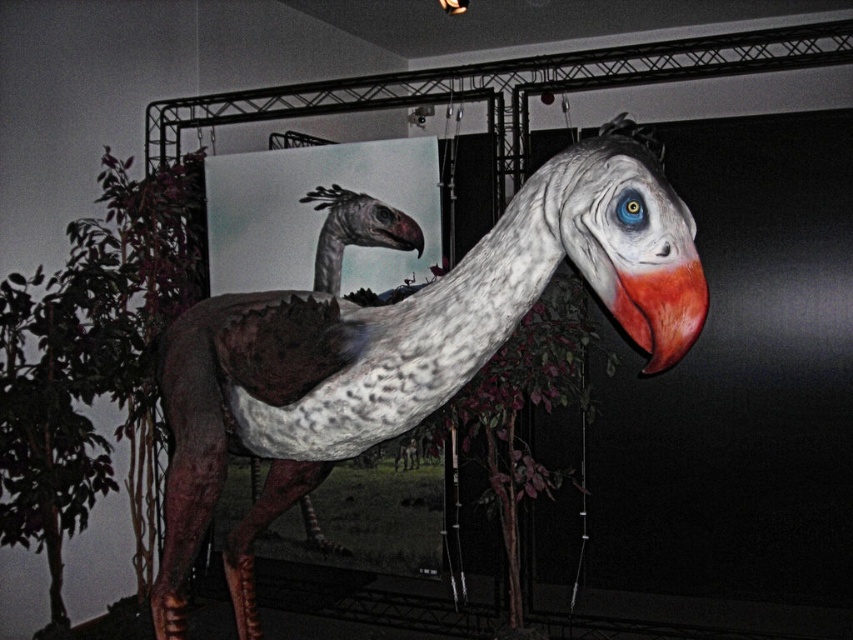
Question: Which point is closer to the camera?

Choices:
 (A) (616, 310)
 (B) (194, 355)

Answer: (A)

Question: Is speckled feathered ostrich at center below matte gray beak at center?

Choices:
 (A) yes
 (B) no

Answer: (A)

Question: Is shiny red beak at center smaller than matte gray beak at center?

Choices:
 (A) yes
 (B) no

Answer: (B)

Question: Which of the following is the farthest from the observer?

Choices:
 (A) (247, 314)
 (B) (410, 220)

Answer: (B)

Question: Estimate the real-world distances between objects in this image. Which object is closer to the speckled feathered ostrich at center?

Choices:
 (A) shiny red beak at center
 (B) matte gray beak at center

Answer: (A)

Question: Does speckled feathered ostrich at center appear on the left side of matte gray beak at center?

Choices:
 (A) no
 (B) yes

Answer: (A)